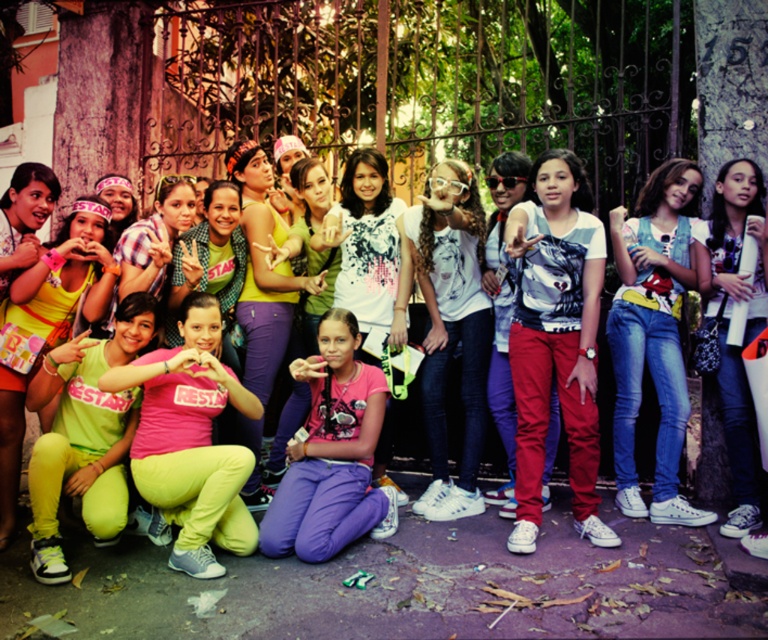
Question: Estimate the real-world distances between objects in this image. Which object is farther from the pink matte shirt at center?

Choices:
 (A) denim jeans at right
 (B) matte yellow pants at lower left

Answer: (A)

Question: Is denim jeans at right smaller than matte yellow pants at lower left?

Choices:
 (A) no
 (B) yes

Answer: (A)

Question: From the image, what is the correct spatial relationship of denim jeans at right in relation to matte yellow pants at lower left?

Choices:
 (A) above
 (B) below

Answer: (A)

Question: Is denim jeans at right positioned before matte yellow pants at lower left?

Choices:
 (A) yes
 (B) no

Answer: (B)

Question: Estimate the real-world distances between objects in this image. Which object is farther from the matte yellow pants at lower left?

Choices:
 (A) denim jeans at right
 (B) pink matte shirt at center

Answer: (A)

Question: Which point is farther to the camera?

Choices:
 (A) (379, 426)
 (B) (660, 209)
 (C) (98, 228)

Answer: (B)